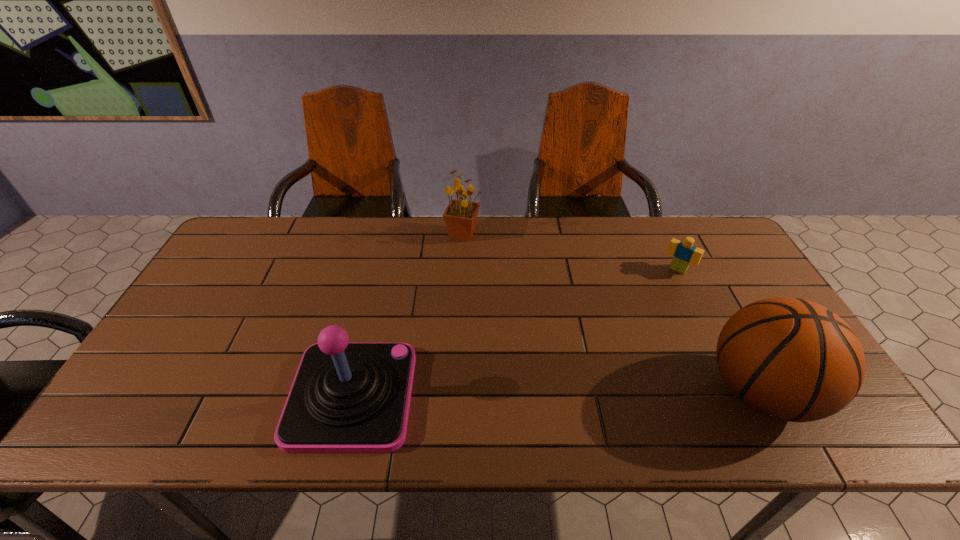
Identify the location of joystick. (346, 397).

At what (x,y) coordinates should I click in order to perform the action: click on basketball. Please return your answer as a coordinate pair (x, y). Looking at the image, I should click on [x=790, y=359].

Where is `the farthest object`? The width and height of the screenshot is (960, 540). the farthest object is located at coordinates (460, 217).

Where is `the second object from left to right`? the second object from left to right is located at coordinates (460, 217).

In order to click on the third nearest object in this screenshot , I will do `click(684, 253)`.

The width and height of the screenshot is (960, 540). Identify the location of the shortest object. click(684, 253).

Image resolution: width=960 pixels, height=540 pixels. I want to click on free location located forward from the base of the leftmost object, so click(x=543, y=396).

Find the location of a particular element. free space located 0.320m on the left of the basketball is located at coordinates (x=569, y=391).

At what (x,y) coordinates should I click in order to perform the action: click on free spot located at the front of the sunflower with flowers visible. Please return your answer as a coordinate pair (x, y). This screenshot has width=960, height=540. Looking at the image, I should click on (484, 255).

Locate an element on the screen. The height and width of the screenshot is (540, 960). free space located at the front of the sunflower with flowers visible is located at coordinates (484, 255).